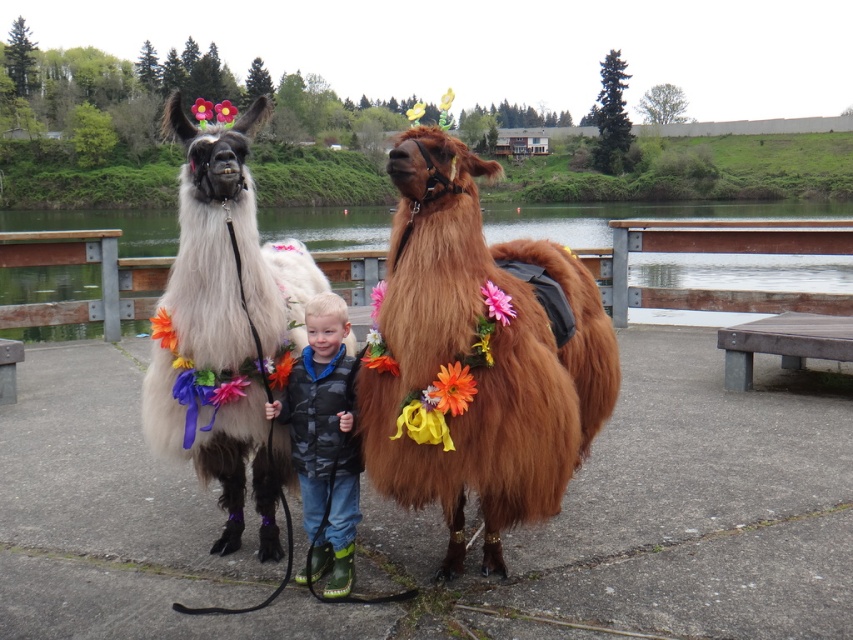
Is white fluffy alpaca at center thinner than camouflage jacket at center?

Result: No.

Who is higher up, white fluffy alpaca at center or camouflage jacket at center?

white fluffy alpaca at center

The width and height of the screenshot is (853, 640). What are the coordinates of `white fluffy alpaca at center` in the screenshot? It's located at (225, 330).

The height and width of the screenshot is (640, 853). Find the location of `white fluffy alpaca at center`. white fluffy alpaca at center is located at coordinates (225, 330).

Can you confirm if brown fuzzy camel at center is positioned below white fluffy alpaca at center?

Incorrect, brown fuzzy camel at center is not positioned below white fluffy alpaca at center.

Between brown fuzzy camel at center and white fluffy alpaca at center, which one has less height?

With less height is brown fuzzy camel at center.

Is point (436, 410) in front of point (252, 268)?

Yes, point (436, 410) is closer to viewer.

You are a GUI agent. You are given a task and a screenshot of the screen. Output one action in this format:
    pyautogui.click(x=<x>, y=<y>)
    Task: Click on the brown fuzzy camel at center
    The height and width of the screenshot is (640, 853).
    Given the screenshot: What is the action you would take?
    pyautogui.click(x=476, y=358)

Which of these two, brown fuzzy camel at center or camouflage jacket at center, stands shorter?

camouflage jacket at center

Is brown fuzzy camel at center positioned at the back of camouflage jacket at center?

No, it is in front of camouflage jacket at center.

The height and width of the screenshot is (640, 853). Identify the location of brown fuzzy camel at center. (476, 358).

Find the location of a particular element. brown fuzzy camel at center is located at coordinates pos(476,358).